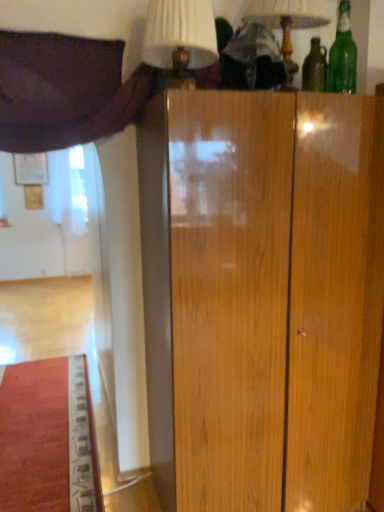
Question: From a real-world perspective, is green glass bottle at upper right physically located above or below white fabric lampshade at upper center, the second table lamp positioned from the right?

Choices:
 (A) above
 (B) below

Answer: (A)

Question: In the image, is green glass bottle at upper right on the left side or the right side of white fabric lampshade at upper center, the second table lamp positioned from the right?

Choices:
 (A) left
 (B) right

Answer: (B)

Question: Based on their relative distances, which object is nearer to the matte white lampshade at upper center, which appears as the second table lamp when viewed from the left?

Choices:
 (A) purple fabric curtain at upper left
 (B) green glass bottle at upper right
 (C) white fabric lampshade at upper center, the second table lamp positioned from the right

Answer: (B)

Question: Which object is the farthest from the matte white lampshade at upper center, arranged as the first table lamp when viewed from the right?

Choices:
 (A) white fabric lampshade at upper center, which ranks as the 1th table lamp in left-to-right order
 (B) green glass bottle at upper right
 (C) purple fabric curtain at upper left

Answer: (C)